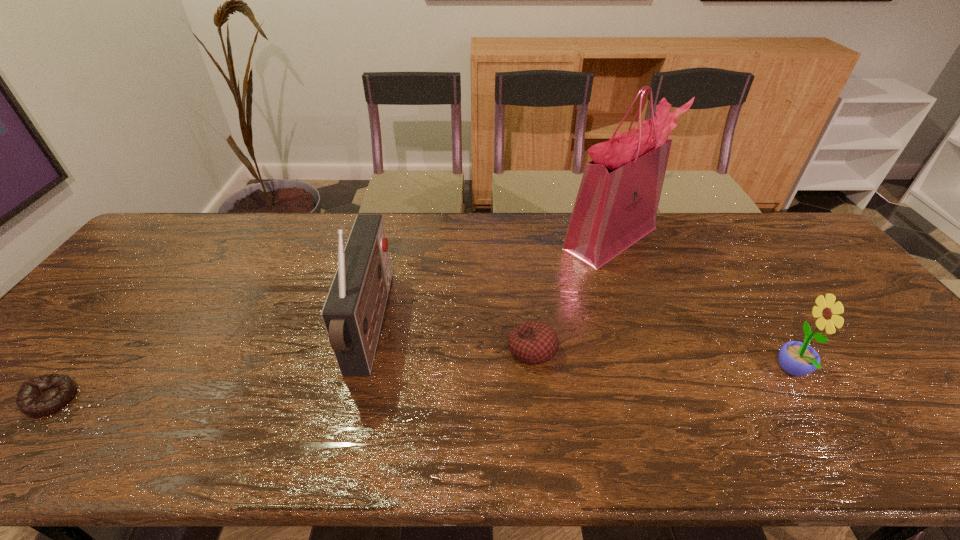
Where is `vacant region at the near edge of the desktop`? This screenshot has width=960, height=540. vacant region at the near edge of the desktop is located at coordinates (460, 430).

Where is `vacant space at the far left corner of the desktop`? The width and height of the screenshot is (960, 540). vacant space at the far left corner of the desktop is located at coordinates (201, 212).

The image size is (960, 540). Find the location of `empty space between the fourth shortest object and the sunflower`. empty space between the fourth shortest object and the sunflower is located at coordinates (582, 349).

The width and height of the screenshot is (960, 540). I want to click on empty space that is in between the third object from right to left and the radio receiver, so click(x=451, y=338).

At what (x,y) coordinates should I click in order to perform the action: click on free spot between the farthest object and the third shortest object. Please return your answer as a coordinate pair (x, y). Looking at the image, I should click on click(702, 305).

In order to click on vacant point located between the rightmost object and the fourth object from left to right in this screenshot , I will do `click(702, 305)`.

Where is `empty space between the fourth object from right to left and the shopping bag`? The height and width of the screenshot is (540, 960). empty space between the fourth object from right to left and the shopping bag is located at coordinates (491, 282).

Find the location of a particular element. This screenshot has width=960, height=540. unoccupied area between the fourth shortest object and the farther beanbag is located at coordinates (451, 338).

Locate an element on the screen. The image size is (960, 540). free space between the third shortest object and the farthest object is located at coordinates (702, 305).

I want to click on free area in between the farthest object and the fourth shortest object, so click(491, 282).